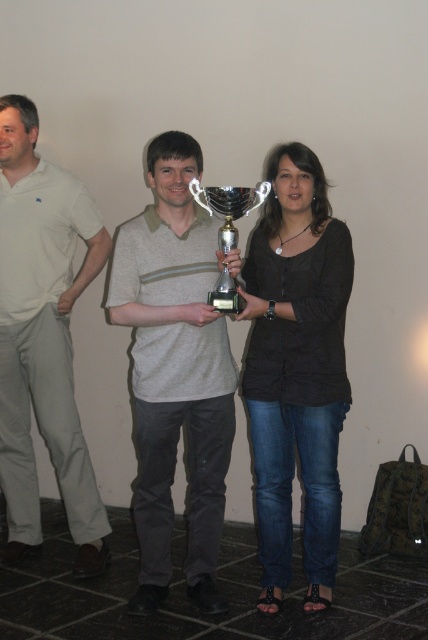
You are a photographer trying to capture a photo of the black matte shirt at center and the silver metallic trophy at center. Based on their heights, which one should you focus on first if you want to ensure both are in frame?

The black matte shirt at center is taller than the silver metallic trophy at center, so focus on the black matte shirt at center first to ensure the trophy fits within the frame.

You are a photographer standing 5 feet away from the gray striped polo shirt at center and the silver metallic trophy at center. If you want to capture both objects in a single photo without moving the camera, will the 13.21 inches between them allow this?

The distance between the gray striped polo shirt at center and the silver metallic trophy at center is 13.21 inches. Since you are 5 feet away from both objects, the separation between them is manageable, so yes, you can capture both in a single photo without moving the camera.